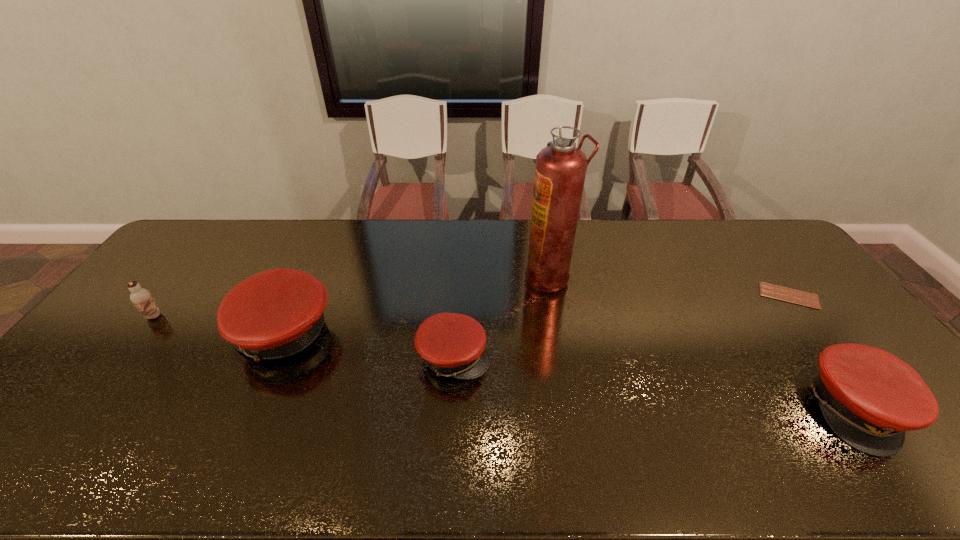
This screenshot has height=540, width=960. In order to click on free spot between the third shortest object and the fire extinguisher in this screenshot , I will do `click(703, 343)`.

Where is `free space that is in between the tallest cap and the third object from right to left`? The height and width of the screenshot is (540, 960). free space that is in between the tallest cap and the third object from right to left is located at coordinates (416, 306).

Where is `unoccupied position between the chocolate milk and the second object from left to right`? unoccupied position between the chocolate milk and the second object from left to right is located at coordinates (218, 325).

You are a GUI agent. You are given a task and a screenshot of the screen. Output one action in this format:
    pyautogui.click(x=<x>, y=<y>)
    Task: Click on the free space between the second shortest object and the shortest object
    This screenshot has width=960, height=540.
    Given the screenshot: What is the action you would take?
    pyautogui.click(x=621, y=326)

Locate an element on the screen. The width and height of the screenshot is (960, 540). free space between the second shortest object and the rightmost cap is located at coordinates point(656,382).

Find the location of a particular element. free space between the chocolate bar and the second shortest object is located at coordinates (621, 326).

This screenshot has width=960, height=540. What are the coordinates of `object that stands as the second closest to the third object from left to right` in the screenshot? It's located at (277, 313).

The height and width of the screenshot is (540, 960). I want to click on object that can be found as the third closest to the third object from left to right, so click(x=869, y=397).

Choose which cap is the second nearest neighbor to the leftmost cap. Please provide its 2D coordinates. Your answer should be formatted as a tuple, i.e. [(x, y)], where the tuple contains the x and y coordinates of a point satisfying the conditions above.

[(869, 397)]

Where is `cap that is the nearest to the rightmost cap`? This screenshot has height=540, width=960. cap that is the nearest to the rightmost cap is located at coordinates (451, 344).